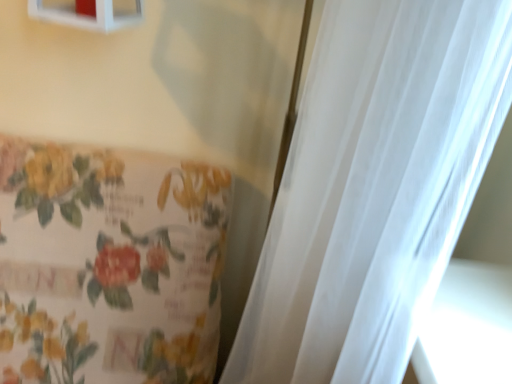
Locate an element on the screen. The image size is (512, 384). white sheer curtain at right is located at coordinates (374, 188).

Measure the distance between point (397, 208) and camera.

Point (397, 208) and camera are 13.66 inches apart.

What do you see at coordinates (374, 188) in the screenshot? I see `white sheer curtain at right` at bounding box center [374, 188].

This screenshot has height=384, width=512. I want to click on white sheer curtain at right, so click(x=374, y=188).